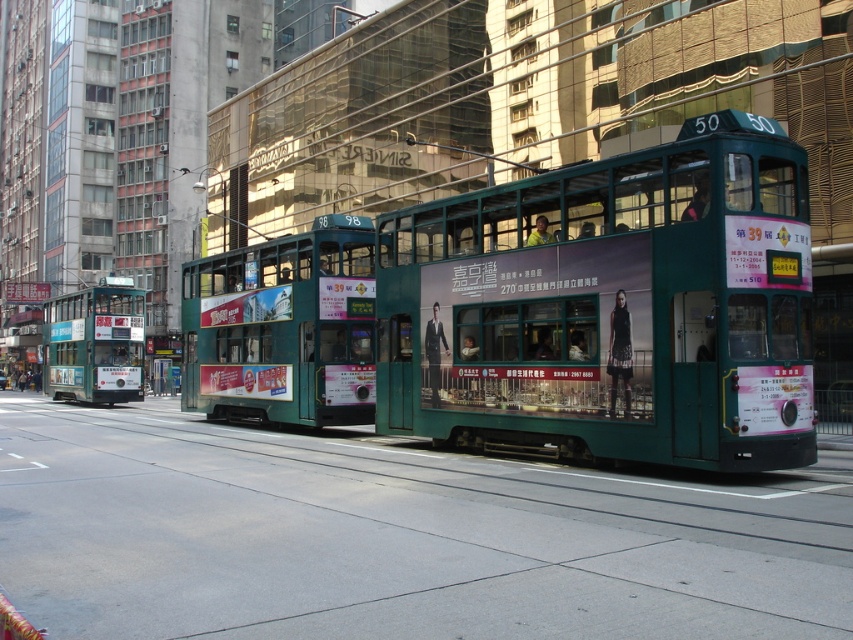
Does green metallic tram at center appear on the left side of green metallic tram at left?

In fact, green metallic tram at center is to the right of green metallic tram at left.

Who is positioned more to the right, green metallic tram at center or green metallic tram at left?

green metallic tram at center

Does point (315, 362) come behind point (131, 314)?

No, (315, 362) is in front of (131, 314).

Identify the location of green metallic tram at center. The width and height of the screenshot is (853, 640). (283, 326).

Between green matte double-decker bus at center and green metallic tram at left, which one has less height?

green matte double-decker bus at center

Does green matte double-decker bus at center appear over green metallic tram at left?

Indeed, green matte double-decker bus at center is positioned over green metallic tram at left.

Locate an element on the screen. green matte double-decker bus at center is located at coordinates click(x=611, y=307).

I want to click on green matte double-decker bus at center, so click(611, 307).

Can you confirm if green matte double-decker bus at center is positioned below green metallic tram at center?

Incorrect, green matte double-decker bus at center is not positioned below green metallic tram at center.

Between point (624, 429) and point (260, 248), which one is positioned in front?

Positioned in front is point (624, 429).

Between point (643, 301) and point (318, 342), which one is positioned in front?

Point (643, 301) is more forward.

The image size is (853, 640). I want to click on green matte double-decker bus at center, so click(x=611, y=307).